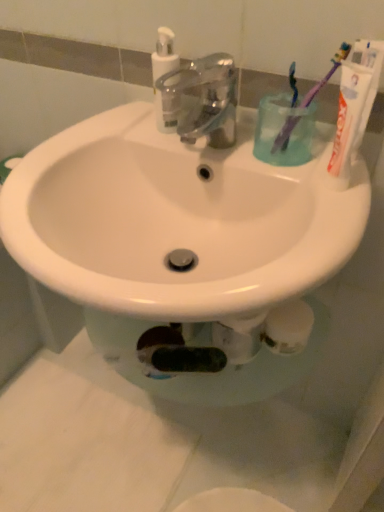
Identify the location of free space that is to the left of purple plastic toothbrush at upper right, which is the first toothbrush from left to right. This screenshot has width=384, height=512. (211, 138).